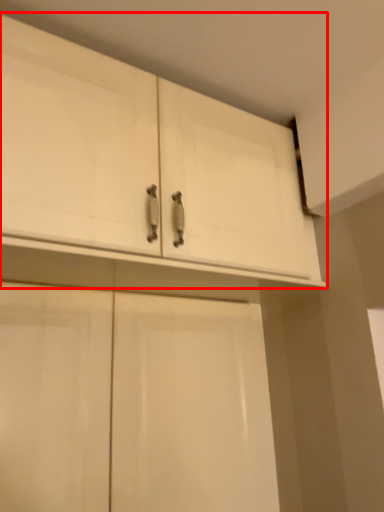
Question: Considering the relative positions of cabinetry (annotated by the red box) and cabinetry in the image provided, where is cabinetry (annotated by the red box) located with respect to the staircase?

Choices:
 (A) left
 (B) right

Answer: (B)